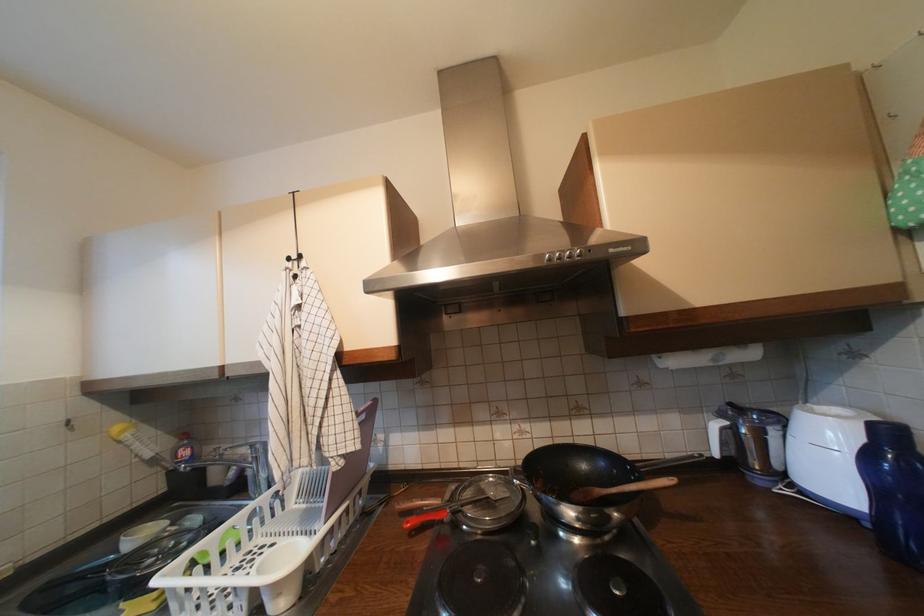
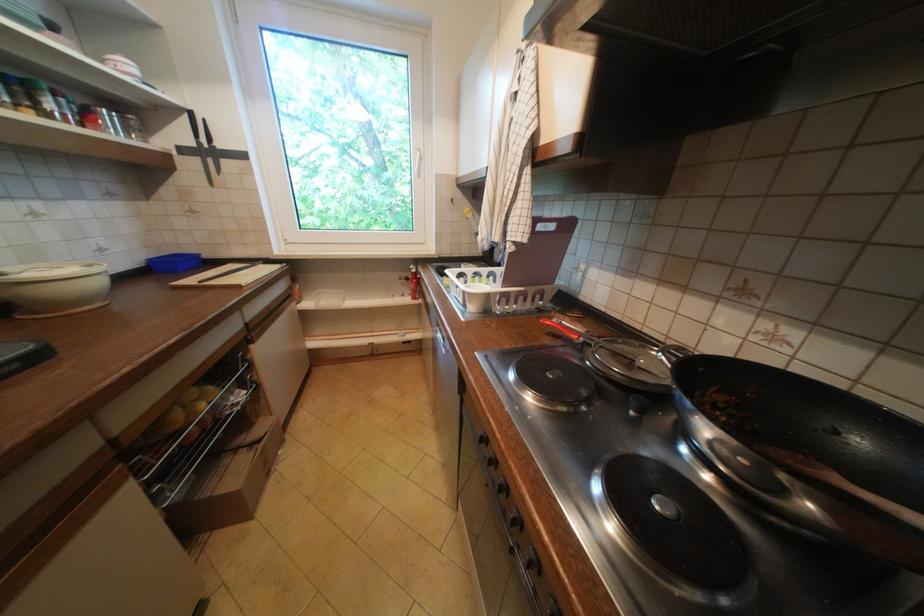
In the second image, find the point that corresponds to point 421,533 in the first image.

(558, 334)